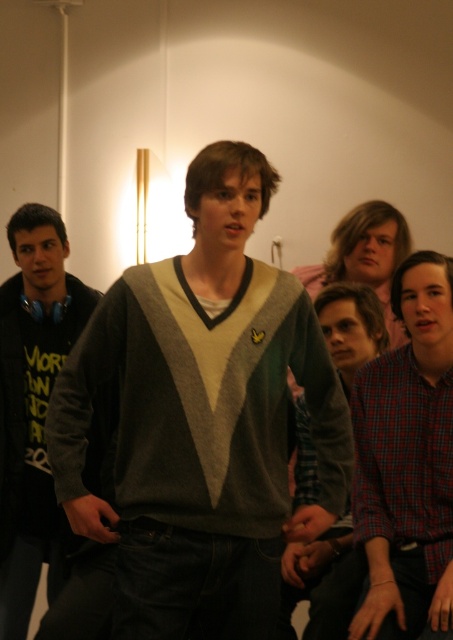
You are taking a photo of the knit sweater at center and the black matte hoodie at left. Which one will appear larger in the photo?

The knit sweater at center will appear larger in the photo because it is closer to the viewer than the black matte hoodie at left.

You are organizing a charity clothing drive and need to determine which items can fit into a donation box that has a maximum capacity for medium sized clothing items. The knit sweater at center and plaid shirt at center are both candidates. Based on their sizes, which one is more likely to exceed the donation box size limit?

The knit sweater at center is bigger than plaid shirt at center, so the knit sweater at center is more likely to exceed the donation box size limit.

Where is the knit sweater at center located in terms of coordinates?

The knit sweater at center is located at coordinates point (202, 419).